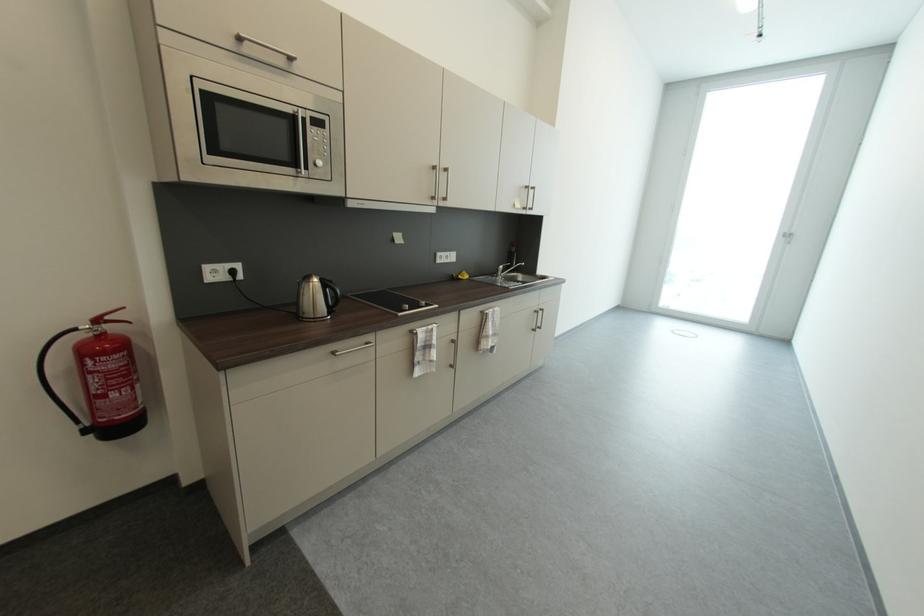
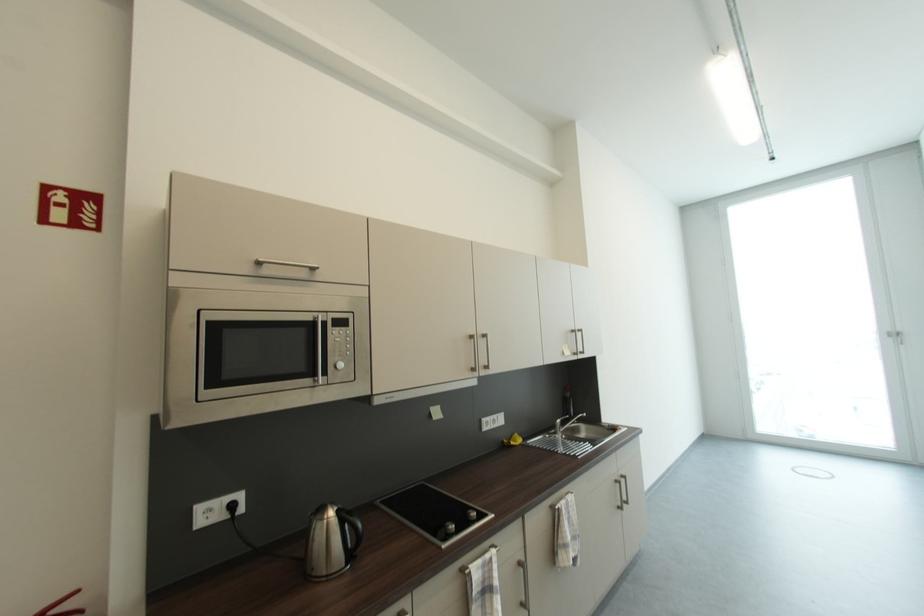
Question: Based on the continuous images, in which direction is the camera rotating? Reply with the corresponding letter.

Choices:
 (A) Left
 (B) Right
 (C) Up
 (D) Down

Answer: (C)